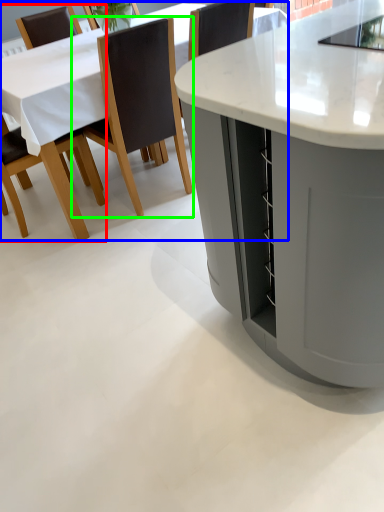
Question: Estimate the real-world distances between objects in this image. Which object is farther from chair (highlighted by a red box), table (highlighted by a blue box) or chair (highlighted by a green box)?

Choices:
 (A) table
 (B) chair

Answer: (B)